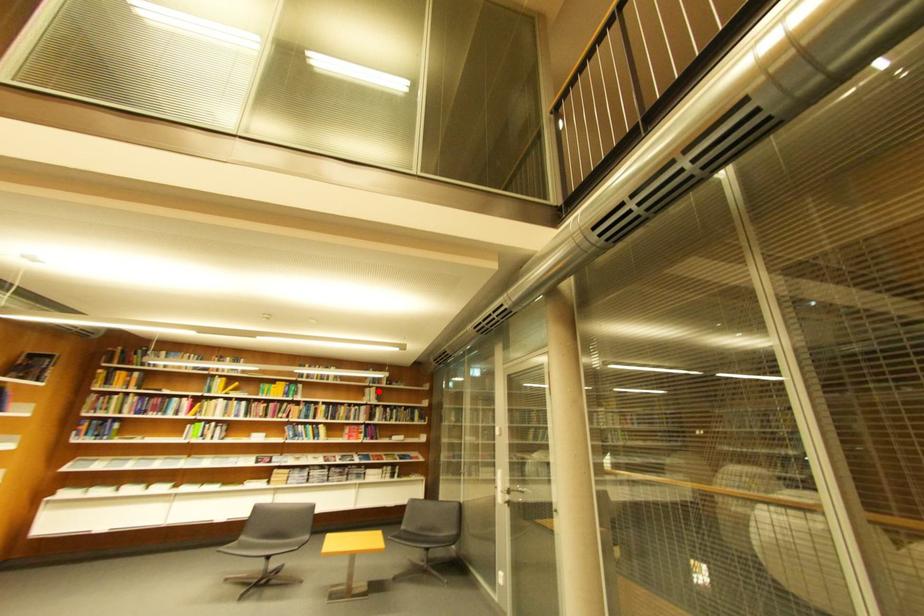
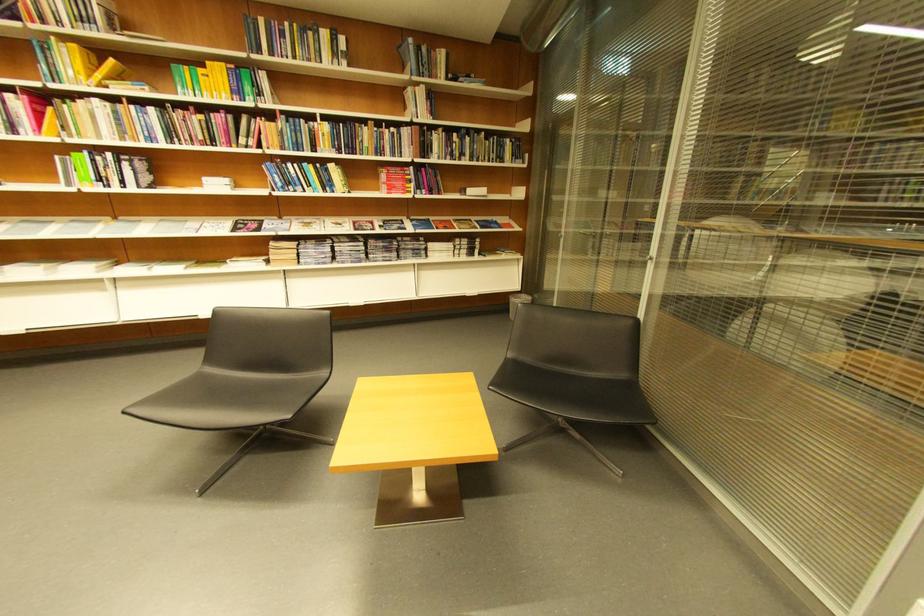
Find the pixel in the second image that matches the highlighted location in the first image.

(419, 91)